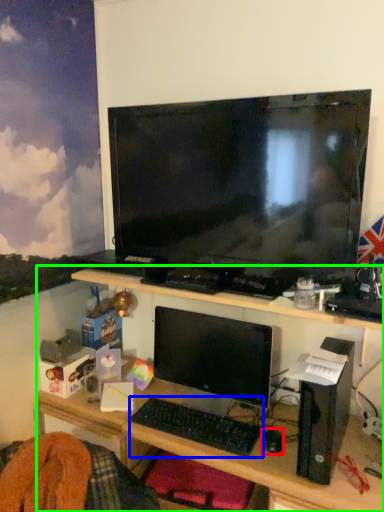
Question: Based on their relative distances, which object is farther from mouse (highlighted by a red box)? Choose from computer keyboard (highlighted by a blue box) and desk (highlighted by a green box).

Choices:
 (A) computer keyboard
 (B) desk

Answer: (B)